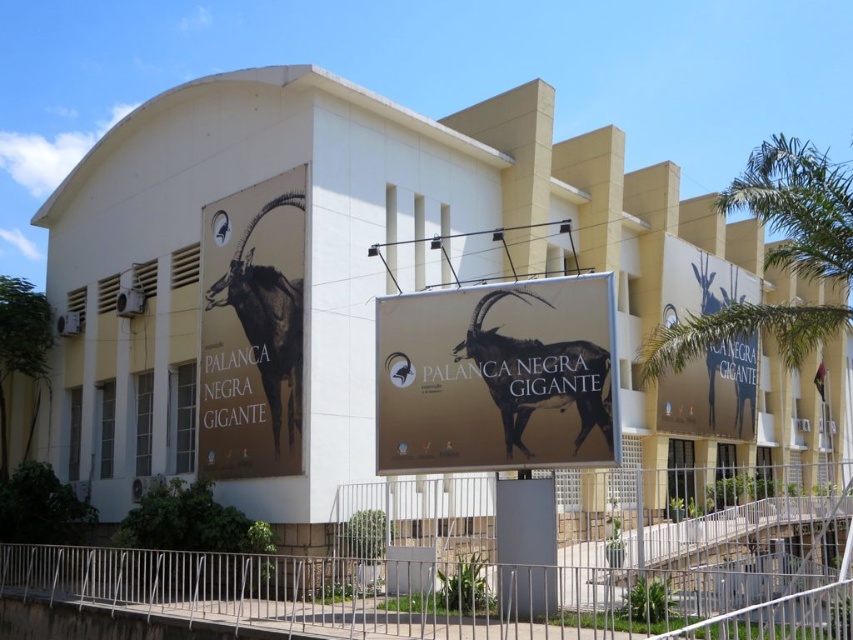
You are a visitor approaching the building and need to reach the gold matte sign at center. Which direction should you move relative to the metallic silver fence at lower center to get there?

The gold matte sign at center is on the right side of the metallic silver fence at lower center, so you should move to the right of the metallic silver fence at lower center to reach it.

You are a visitor approaching the modern building and notice the metallic silver fence at lower center and the matte gold sign at upper right. Which object is shorter in height?

The metallic silver fence at lower center has a lesser height compared to the matte gold sign at upper right, so the metallic silver fence at lower center is shorter.

You are a visitor approaching the building and want to see both the metallic silver fence at lower center and the matte gold sign at upper right clearly. Which object will you see first as you walk towards the building?

The metallic silver fence at lower center will be seen first because it is positioned in front of the matte gold sign at upper right, making it closer to your viewpoint as you approach the building.